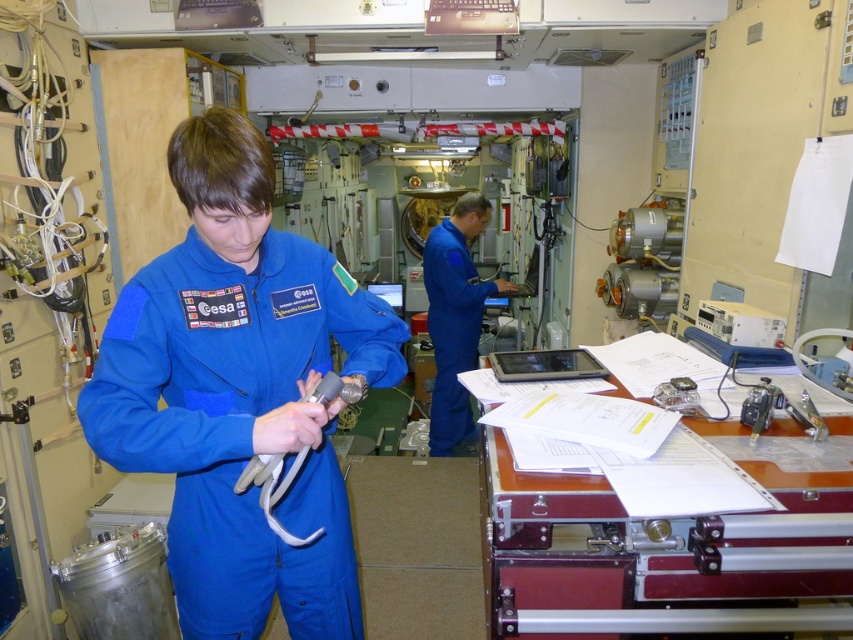
Question: Which object appears farthest from the camera in this image?

Choices:
 (A) white rubber tube at center
 (B) metallic silver briefcase at lower right

Answer: (A)

Question: Among these objects, which one is nearest to the camera?

Choices:
 (A) blue fabric astronaut suit at center
 (B) white rubber tube at center
 (C) blue smooth jumpsuit at center

Answer: (A)

Question: Is blue fabric astronaut suit at center above metallic silver briefcase at lower right?

Choices:
 (A) yes
 (B) no

Answer: (A)

Question: In this image, where is blue fabric astronaut suit at center located relative to white rubber tube at center?

Choices:
 (A) right
 (B) left

Answer: (B)

Question: Can you confirm if blue smooth jumpsuit at center is positioned to the left of white rubber tube at center?

Choices:
 (A) no
 (B) yes

Answer: (A)

Question: Considering the real-world distances, which object is farthest from the blue fabric astronaut suit at center?

Choices:
 (A) white rubber tube at center
 (B) blue smooth jumpsuit at center
 (C) metallic silver briefcase at lower right

Answer: (B)